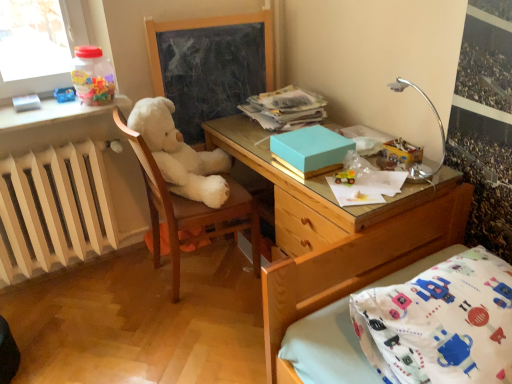
Find the location of a particular element. This screenshot has height=384, width=512. vacant area that is in front of teal matte box at center is located at coordinates (332, 187).